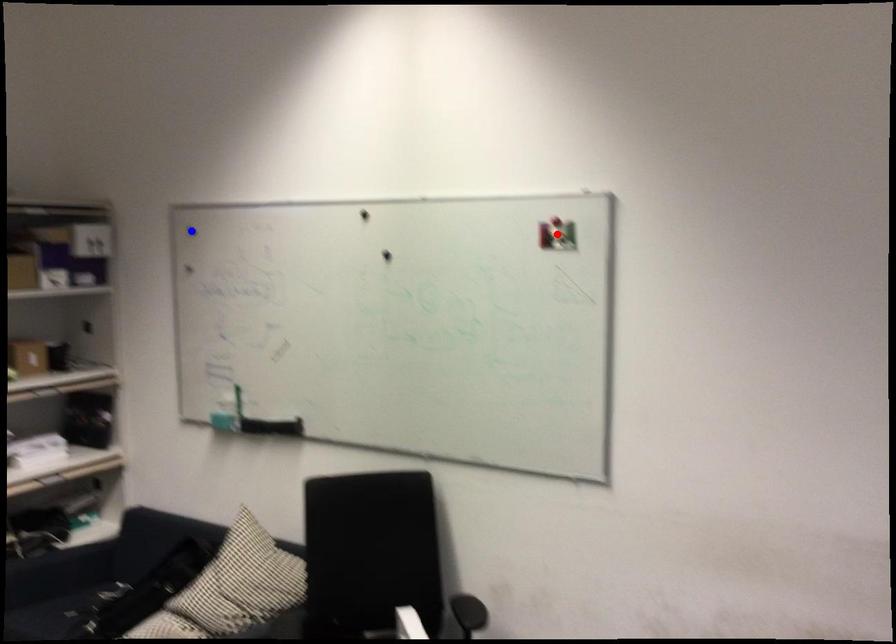
Question: Two points are marked on the image. Which point is closer to the camera?

Choices:
 (A) Blue point is closer.
 (B) Red point is closer.

Answer: (B)